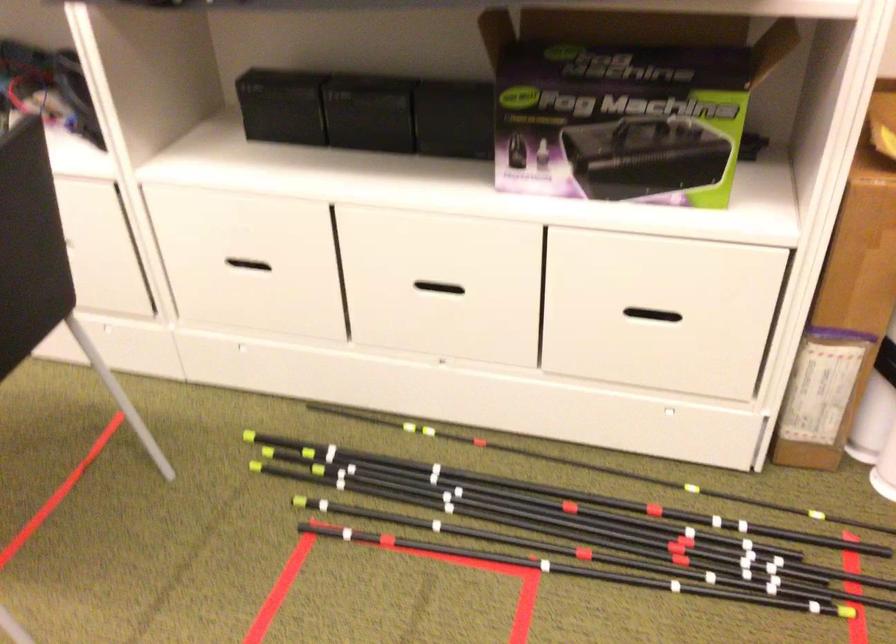
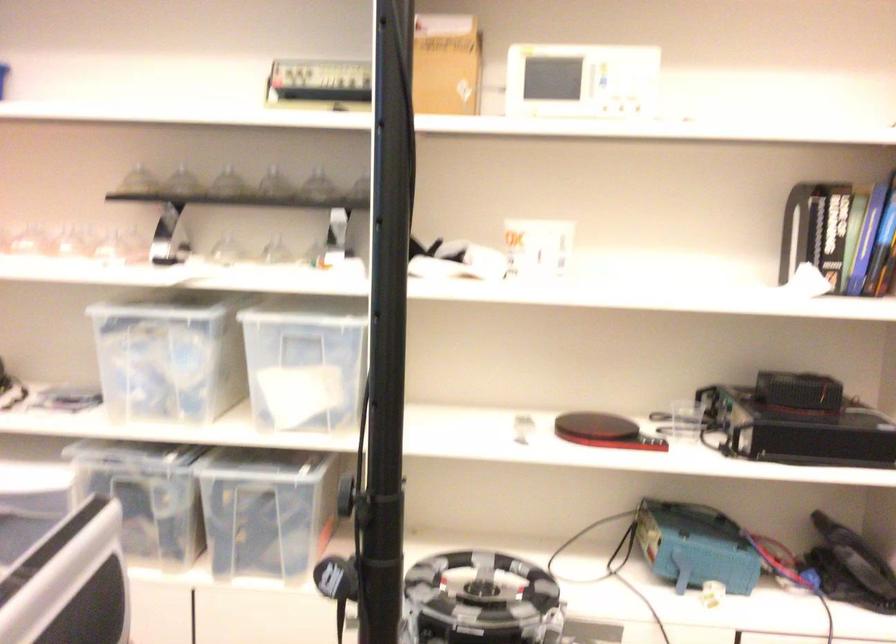
Question: Which direction would the cameraman need to move to produce the second image? Reply with the corresponding letter.

Choices:
 (A) Left
 (B) Right
 (C) Forward
 (D) Backward

Answer: (A)